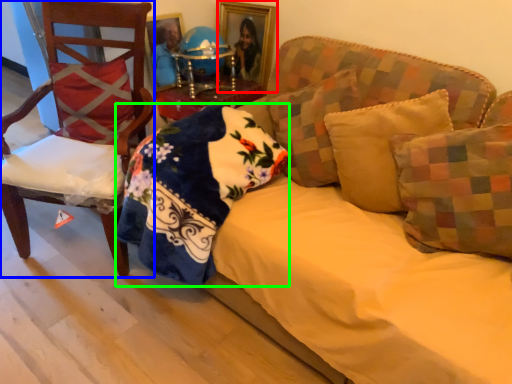
Question: Which object is the farthest from picture frame (highlighted by a red box)? Choose among these: chair (highlighted by a blue box) or material (highlighted by a green box).

Choices:
 (A) chair
 (B) material

Answer: (B)